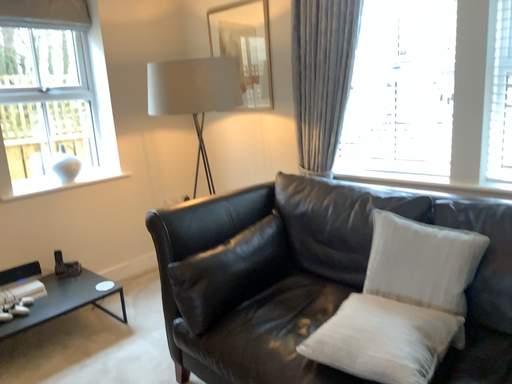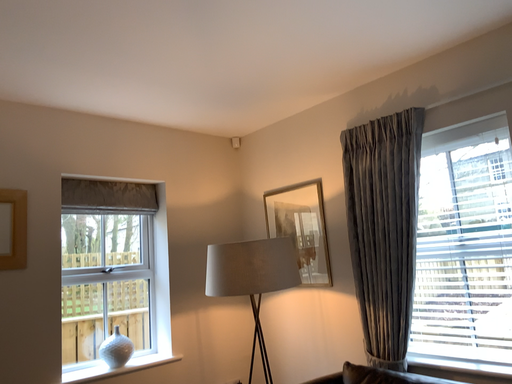
Question: Which way did the camera rotate in the video?

Choices:
 (A) rotated left
 (B) rotated right

Answer: (A)